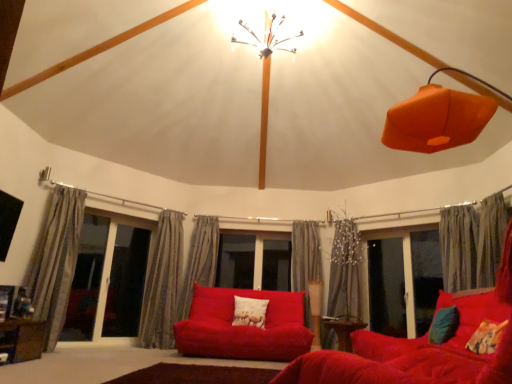
Question: From the image's perspective, is metallic wire chandelier at upper center located beneath gray textured curtain at center, which is counted as the 4th curtain, starting from the left?

Choices:
 (A) yes
 (B) no

Answer: (B)

Question: Is metallic wire chandelier at upper center behind gray textured curtain at center, which is the 4th curtain in right-to-left order?

Choices:
 (A) no
 (B) yes

Answer: (A)

Question: Can you confirm if metallic wire chandelier at upper center is wider than gray textured curtain at center, which is the 4th curtain in right-to-left order?

Choices:
 (A) yes
 (B) no

Answer: (A)

Question: Is metallic wire chandelier at upper center to the right of gray textured curtain at center, which is counted as the 4th curtain, starting from the left, from the viewer's perspective?

Choices:
 (A) no
 (B) yes

Answer: (A)

Question: Is metallic wire chandelier at upper center bigger than gray textured curtain at center, which is the 4th curtain in right-to-left order?

Choices:
 (A) no
 (B) yes

Answer: (B)

Question: Can you confirm if metallic wire chandelier at upper center is positioned to the left of gray textured curtain at center, which is the 4th curtain in right-to-left order?

Choices:
 (A) yes
 (B) no

Answer: (A)

Question: Is metallic wire chandelier at upper center wider than gray textured curtain at center, the 5th curtain in the right-to-left sequence?

Choices:
 (A) no
 (B) yes

Answer: (B)

Question: From the image's perspective, is metallic wire chandelier at upper center located above gray textured curtain at center, which ranks as the 3th curtain in left-to-right order?

Choices:
 (A) no
 (B) yes

Answer: (B)

Question: Considering the relative positions of metallic wire chandelier at upper center and gray textured curtain at center, which ranks as the 3th curtain in left-to-right order, in the image provided, is metallic wire chandelier at upper center to the left of gray textured curtain at center, which ranks as the 3th curtain in left-to-right order, from the viewer's perspective?

Choices:
 (A) no
 (B) yes

Answer: (A)

Question: Is metallic wire chandelier at upper center completely or partially outside of gray textured curtain at center, which ranks as the 3th curtain in left-to-right order?

Choices:
 (A) no
 (B) yes

Answer: (B)

Question: Is metallic wire chandelier at upper center facing towards gray textured curtain at center, which ranks as the 3th curtain in left-to-right order?

Choices:
 (A) no
 (B) yes

Answer: (A)

Question: Does metallic wire chandelier at upper center have a greater height compared to gray textured curtain at center, which ranks as the 3th curtain in left-to-right order?

Choices:
 (A) yes
 (B) no

Answer: (B)

Question: Is wooden table at lower center, which appears as the first table when viewed from the right, further to the viewer compared to brown wooden table at lower left, the 2th table in the bottom-to-top sequence?

Choices:
 (A) yes
 (B) no

Answer: (A)